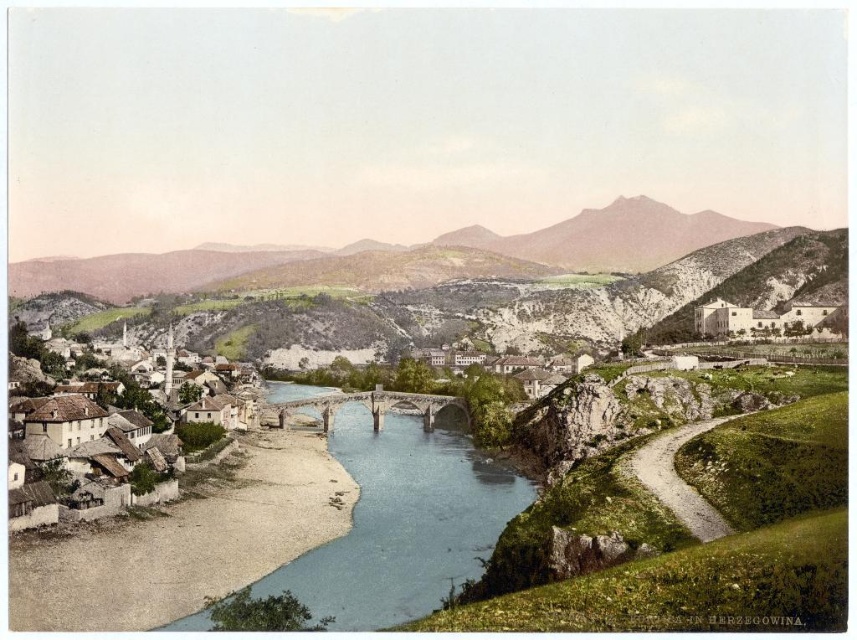
Question: Is blue stone river at center in front of white stone houses at lower left?

Choices:
 (A) yes
 (B) no

Answer: (A)

Question: Can you confirm if blue stone river at center is thinner than white stone houses at lower left?

Choices:
 (A) yes
 (B) no

Answer: (A)

Question: Is the position of rugged stone mountain at center less distant than that of white stone houses at lower left?

Choices:
 (A) no
 (B) yes

Answer: (A)

Question: Which of the following is the farthest from the observer?

Choices:
 (A) blue stone river at center
 (B) rugged stone mountain at center

Answer: (B)

Question: Considering the real-world distances, which object is farthest from the rugged stone mountain at center?

Choices:
 (A) blue stone river at center
 (B) white stone houses at lower left

Answer: (A)

Question: Based on their relative distances, which object is farther from the white stone houses at lower left?

Choices:
 (A) blue stone river at center
 (B) rugged stone mountain at center

Answer: (B)